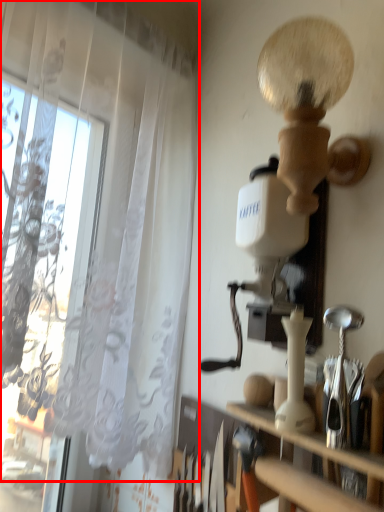
Question: From the image's perspective, where is curtain (annotated by the red box) located relative to shelf?

Choices:
 (A) above
 (B) below

Answer: (A)